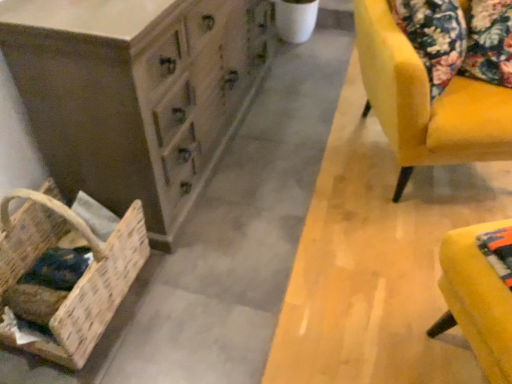
Question: Can you confirm if wooden chest of drawers at lower left is thinner than yellow fabric ottoman at lower right?

Choices:
 (A) no
 (B) yes

Answer: (A)

Question: Does wooden chest of drawers at lower left have a smaller size compared to yellow fabric ottoman at lower right?

Choices:
 (A) no
 (B) yes

Answer: (A)

Question: Is wooden chest of drawers at lower left positioned before yellow fabric ottoman at lower right?

Choices:
 (A) no
 (B) yes

Answer: (A)

Question: From the image's perspective, is wooden chest of drawers at lower left beneath yellow fabric ottoman at lower right?

Choices:
 (A) yes
 (B) no

Answer: (B)

Question: Does wooden chest of drawers at lower left have a larger size compared to yellow fabric ottoman at lower right?

Choices:
 (A) no
 (B) yes

Answer: (B)

Question: Is wooden chest of drawers at lower left facing away from yellow fabric ottoman at lower right?

Choices:
 (A) yes
 (B) no

Answer: (B)

Question: Is yellow fabric ottoman at lower right at the right side of velvet yellow chair at right?

Choices:
 (A) yes
 (B) no

Answer: (B)

Question: Is yellow fabric ottoman at lower right looking in the opposite direction of velvet yellow chair at right?

Choices:
 (A) no
 (B) yes

Answer: (A)

Question: Can you confirm if yellow fabric ottoman at lower right is wider than velvet yellow chair at right?

Choices:
 (A) no
 (B) yes

Answer: (A)

Question: Is yellow fabric ottoman at lower right surrounding velvet yellow chair at right?

Choices:
 (A) no
 (B) yes

Answer: (A)

Question: Is yellow fabric ottoman at lower right not close to velvet yellow chair at right?

Choices:
 (A) no
 (B) yes

Answer: (A)

Question: From the image's perspective, is yellow fabric ottoman at lower right beneath velvet yellow chair at right?

Choices:
 (A) yes
 (B) no

Answer: (A)

Question: From a real-world perspective, does wooden chest of drawers at lower left stand above velvet yellow chair at right?

Choices:
 (A) no
 (B) yes

Answer: (A)